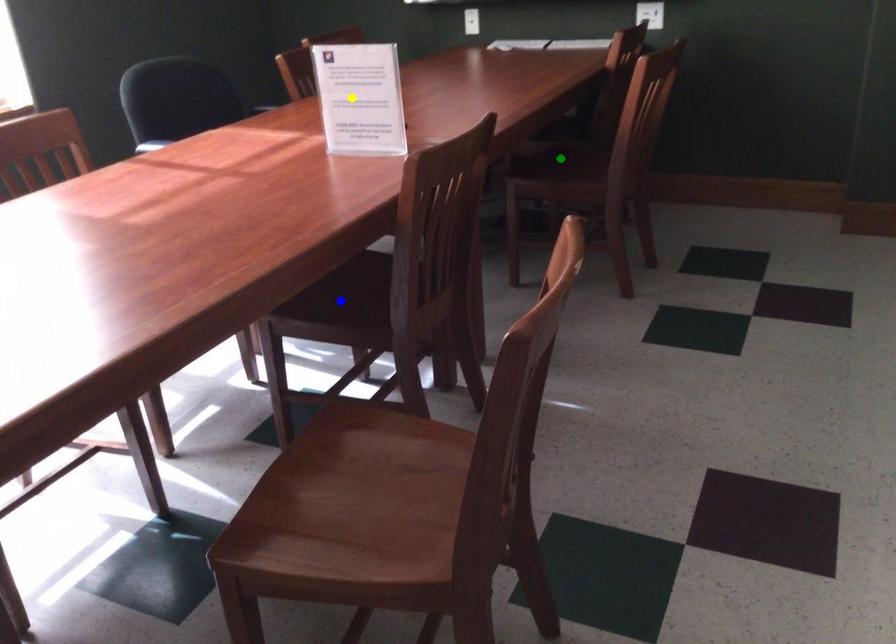
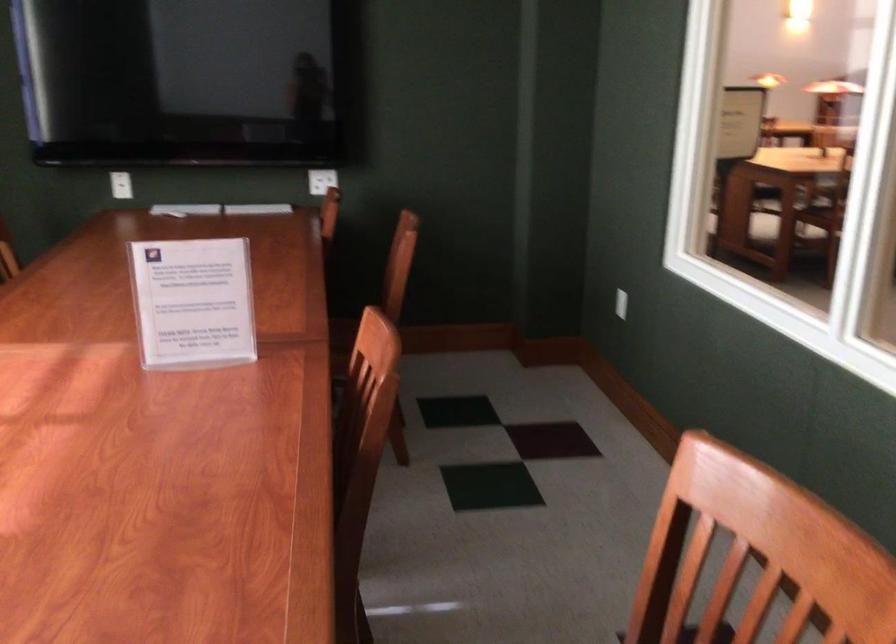
I am providing you with two images of the same scene from different viewpoints. Three points are marked in image1. Which point corresponds to a part or object that is occluded in image2?In image1, three points are marked. Which of them correspond to a part or object that is occluded in image2?Among the three points shown in image1, which one corresponds to a part or object that is no longer visible due to occlusion in image2?

blue point, green point